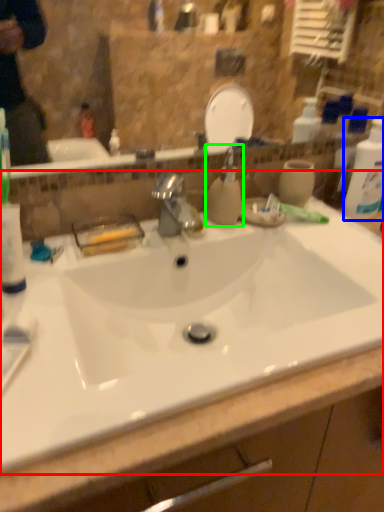
Question: Based on their relative distances, which object is farther from sink (highlighted by a red box)? Choose from cleaning product (highlighted by a blue box) and soap dispenser (highlighted by a green box).

Choices:
 (A) cleaning product
 (B) soap dispenser

Answer: (A)